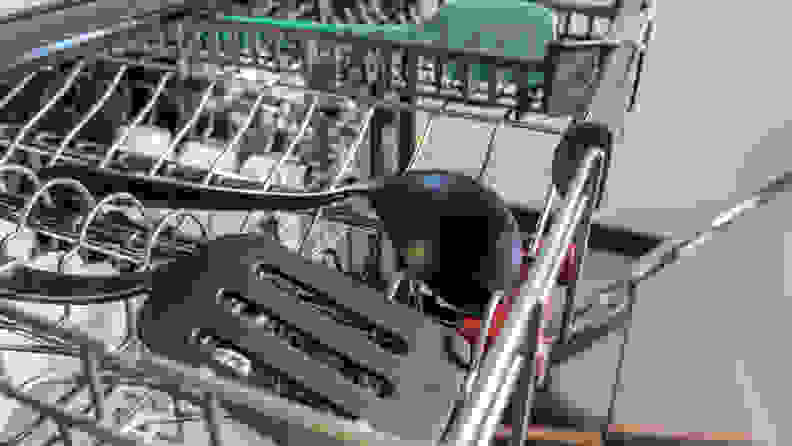
Where is `green spatula`? green spatula is located at coordinates (501, 30).